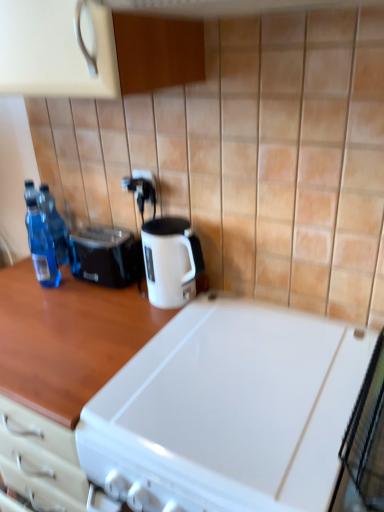
Question: Is transparent plastic bottles at left, marked as the second bottle in a front-to-back arrangement, inside the boundaries of woodenmaterial/texturecountertop at center, arranged as the 2th countertop when viewed from the right, or outside?

Choices:
 (A) inside
 (B) outside

Answer: (B)

Question: In the image, is transparent plastic bottles at left, marked as the second bottle in a front-to-back arrangement, positioned in front of or behind woodenmaterial/texturecountertop at center, marked as the first countertop in a left-to-right arrangement?

Choices:
 (A) behind
 (B) front

Answer: (A)

Question: Estimate the real-world distances between objects in this image. Which object is closer to the white glossy countertop at upper left, arranged as the first countertop when viewed from the right?

Choices:
 (A) transparent plastic bottles at left, marked as the second bottle in a front-to-back arrangement
 (B) black plastic electric outlet at upper center, which ranks as the 2th electric outlet in bottom-to-top order
 (C) white glossy electric kettle at center
 (D) white plastic electric outlet at center, the first electric outlet ordered from the bottom
 (E) transparent plastic bottles at left, which is the first bottle from front to back

Answer: (C)

Question: Estimate the real-world distances between objects in this image. Which object is closer to the white glossy electric kettle at center?

Choices:
 (A) woodenmaterial/texturecountertop at center, arranged as the 2th countertop when viewed from the right
 (B) transparent plastic bottles at left, which is the first bottle from front to back
 (C) black plastic electric outlet at upper center, which ranks as the 2th electric outlet in bottom-to-top order
 (D) black plastic toaster at left
 (E) white glossy countertop at upper left, arranged as the first countertop when viewed from the right

Answer: (C)